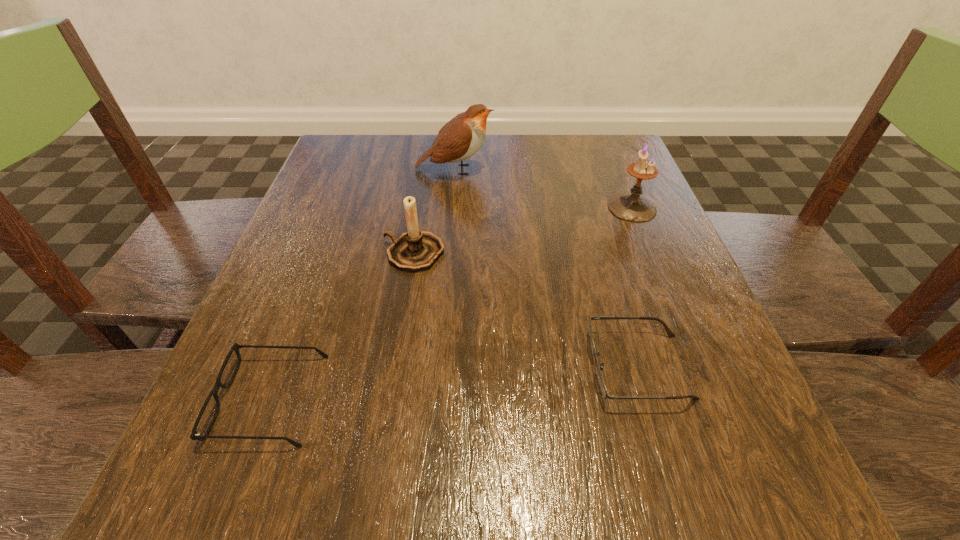
Identify the location of free point that satisfies the following two spatial constraints: 1. on the back side of the second farthest object; 2. at the face of the farthest object. (616, 170).